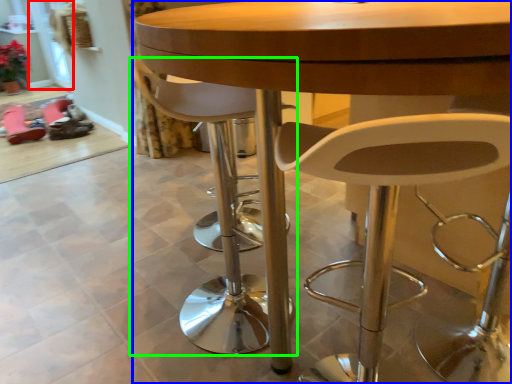
Question: Based on their relative distances, which object is nearer to glass door (highlighted by a red box)? Choose from table (highlighted by a blue box) and chair (highlighted by a green box).

Choices:
 (A) table
 (B) chair

Answer: (B)